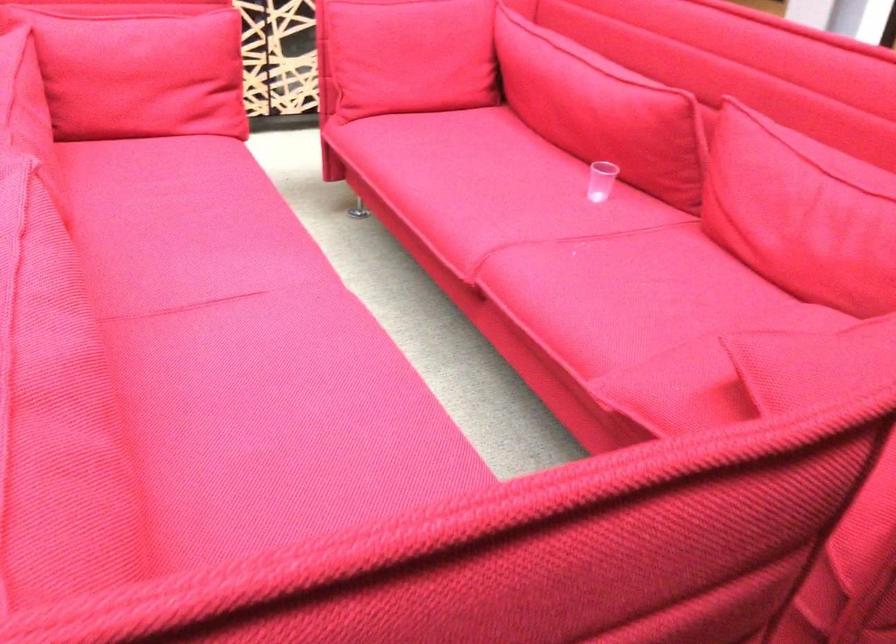
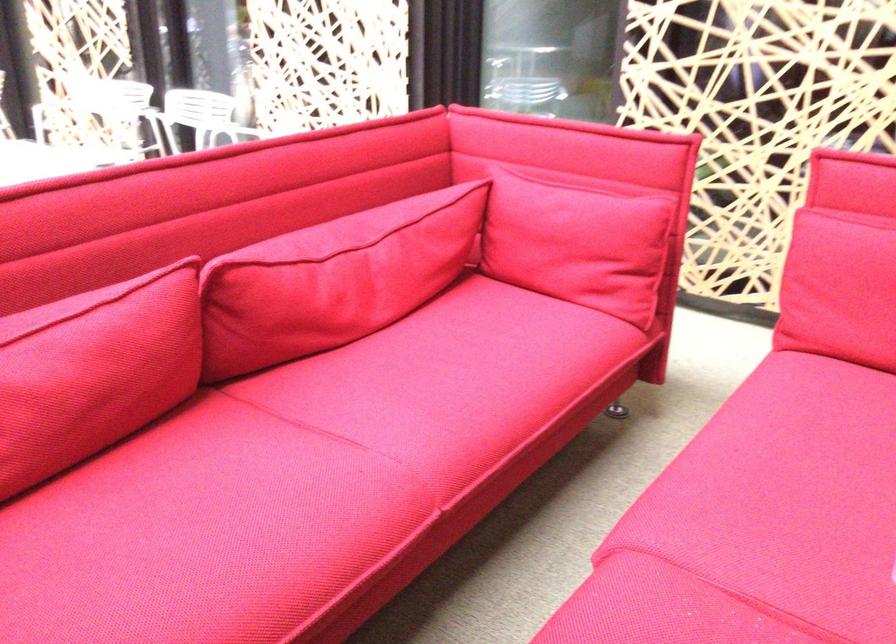
Where in the second image is the point corresponding to pixel 538 212 from the first image?

(759, 522)